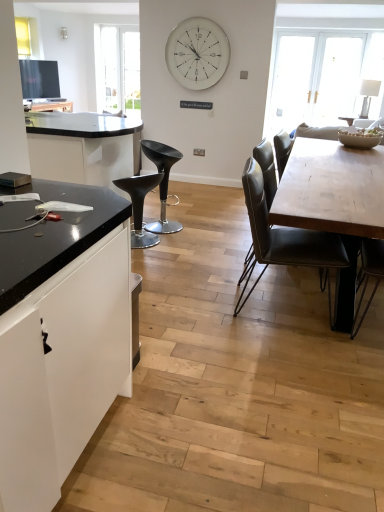
What do you see at coordinates (197, 53) in the screenshot? Image resolution: width=384 pixels, height=512 pixels. I see `white glossy clock at upper center` at bounding box center [197, 53].

Find the location of a particular element. leather-like black chair at center, marked as the first chair in a right-to-left arrangement is located at coordinates (285, 240).

Identify the location of black plastic stool at center, which appears as the third chair when viewed from the front. The image size is (384, 512). (162, 182).

The image size is (384, 512). What do you see at coordinates (334, 204) in the screenshot?
I see `wooden table at center` at bounding box center [334, 204].

Where is `matte black stool at center, marked as the 1th chair in a left-to-right arrangement`? This screenshot has height=512, width=384. matte black stool at center, marked as the 1th chair in a left-to-right arrangement is located at coordinates (140, 206).

Find the location of a particular element. This screenshot has height=512, width=384. white glossy clock at upper center is located at coordinates (197, 53).

Is black plastic stool at center, marked as the 1th chair in a back-to-front arrangement, taller or shorter than white glossy clock at upper center?

Considering their sizes, black plastic stool at center, marked as the 1th chair in a back-to-front arrangement, has less height than white glossy clock at upper center.

Identify the location of the 1st chair counting from the left side of the white glossy clock at upper center. (162, 182).

From the image's perspective, is black plastic stool at center, the second chair viewed from the left, above or below white glossy clock at upper center?

Clearly, from the image's perspective, black plastic stool at center, the second chair viewed from the left, is below white glossy clock at upper center.

Which object is thinner, black plastic stool at center, the second chair viewed from the left, or white glossy clock at upper center?

white glossy clock at upper center is thinner.

Locate an element on the screen. This screenshot has width=384, height=512. clock above the matte black stool at center, the 2th chair positioned from the front (from the image's perspective) is located at coordinates (197, 53).

Would you consider matte black stool at center, placed as the third chair when sorted from right to left, to be distant from white glossy clock at upper center?

matte black stool at center, placed as the third chair when sorted from right to left, is positioned a significant distance from white glossy clock at upper center.

Consider the image. Which is behind, matte black stool at center, which appears as the 2th chair when viewed from the back, or white glossy clock at upper center?

white glossy clock at upper center is further away from the camera.

Is point (131, 194) positioned before point (226, 38)?

Yes, point (131, 194) is in front of point (226, 38).

Considering the relative sizes of matte black stool at center, which appears as the 2th chair when viewed from the back, and wooden table at center in the image provided, is matte black stool at center, which appears as the 2th chair when viewed from the back, bigger than wooden table at center?

No.

Considering the relative positions of matte black stool at center, marked as the 1th chair in a left-to-right arrangement, and wooden table at center in the image provided, is matte black stool at center, marked as the 1th chair in a left-to-right arrangement, to the left of wooden table at center from the viewer's perspective?

Correct, you'll find matte black stool at center, marked as the 1th chair in a left-to-right arrangement, to the left of wooden table at center.

From a real-world perspective, is matte black stool at center, the 2th chair positioned from the front, above or below wooden table at center?

From a real-world perspective, matte black stool at center, the 2th chair positioned from the front, is physically below wooden table at center.

Is matte black stool at center, marked as the 1th chair in a left-to-right arrangement, positioned far away from wooden table at center?

Yes, matte black stool at center, marked as the 1th chair in a left-to-right arrangement, and wooden table at center are located far from each other.

Which is more to the left, black plastic stool at center, the second chair viewed from the left, or wooden table at center?

black plastic stool at center, the second chair viewed from the left.

Choose the correct answer: Is black plastic stool at center, the second chair from the right, inside wooden table at center or outside it?

black plastic stool at center, the second chair from the right, is not inside wooden table at center, it's outside.

In the scene shown: From a real-world perspective, which object rests below the other?

In real-world perspective, black plastic stool at center, marked as the 1th chair in a back-to-front arrangement, is lower.

Is black plastic stool at center, the second chair from the right, directly adjacent to wooden table at center?

black plastic stool at center, the second chair from the right, is not next to wooden table at center, and they're not touching.

Looking at their sizes, would you say wooden table at center is wider or thinner than leather-like black chair at center, marked as the first chair in a right-to-left arrangement?

In the image, wooden table at center appears to be wider than leather-like black chair at center, marked as the first chair in a right-to-left arrangement.

How many degrees apart are the facing directions of wooden table at center and leather-like black chair at center, which appears as the first chair when viewed from the front?

176 degrees separate the facing orientations of wooden table at center and leather-like black chair at center, which appears as the first chair when viewed from the front.

Between point (332, 153) and point (249, 160), which one is positioned behind?

Positioned behind is point (332, 153).

From a real-world perspective, relative to leather-like black chair at center, which appears as the first chair when viewed from the front, is wooden table at center vertically above or below?

In terms of real-world spatial position, wooden table at center is below leather-like black chair at center, which appears as the first chair when viewed from the front.

Can you confirm if wooden table at center is bigger than matte black stool at center, marked as the 1th chair in a left-to-right arrangement?

Yes, wooden table at center is bigger than matte black stool at center, marked as the 1th chair in a left-to-right arrangement.

Are wooden table at center and matte black stool at center, placed as the third chair when sorted from right to left, making contact?

No, wooden table at center is not beside matte black stool at center, placed as the third chair when sorted from right to left.

From a real-world perspective, is wooden table at center on matte black stool at center, which appears as the 2th chair when viewed from the back?

Yes, from a real-world perspective, wooden table at center is on top of matte black stool at center, which appears as the 2th chair when viewed from the back.

Based on the photo, from the image's perspective, would you say wooden table at center is shown under matte black stool at center, marked as the 1th chair in a left-to-right arrangement?

Correct, wooden table at center appears lower than matte black stool at center, marked as the 1th chair in a left-to-right arrangement, in the image.

From the image's perspective, which one is positioned higher, leather-like black chair at center, which appears as the first chair when viewed from the front, or matte black stool at center, marked as the 1th chair in a left-to-right arrangement?

From the image's view, matte black stool at center, marked as the 1th chair in a left-to-right arrangement, is above.

Considering the relative sizes of leather-like black chair at center, marked as the third chair in a left-to-right arrangement, and matte black stool at center, placed as the third chair when sorted from right to left, in the image provided, is leather-like black chair at center, marked as the third chair in a left-to-right arrangement, taller than matte black stool at center, placed as the third chair when sorted from right to left,?

Indeed, leather-like black chair at center, marked as the third chair in a left-to-right arrangement, has a greater height compared to matte black stool at center, placed as the third chair when sorted from right to left.

Visually, is leather-like black chair at center, marked as the first chair in a right-to-left arrangement, positioned to the left or to the right of matte black stool at center, the 2th chair positioned from the front?

Clearly, leather-like black chair at center, marked as the first chair in a right-to-left arrangement, is on the right of matte black stool at center, the 2th chair positioned from the front, in the image.

Is leather-like black chair at center, marked as the third chair in a left-to-right arrangement, situated inside matte black stool at center, marked as the 1th chair in a left-to-right arrangement, or outside?

leather-like black chair at center, marked as the third chair in a left-to-right arrangement, is not inside matte black stool at center, marked as the 1th chair in a left-to-right arrangement, it's outside.

Starting from the white glossy clock at upper center, which chair is the 1st one in front? Please provide its 2D coordinates.

[(162, 182)]

I want to click on the 2nd chair to the left of the white glossy clock at upper center, counting from the anchor's position, so click(x=140, y=206).

From the image, which object appears to be farther from black plastic stool at center, the second chair viewed from the left, leather-like black chair at center, the 3th chair when ordered from back to front, or wooden table at center?

wooden table at center is further to black plastic stool at center, the second chair viewed from the left.

Considering their positions, is wooden table at center positioned closer to matte black stool at center, marked as the 1th chair in a left-to-right arrangement, than leather-like black chair at center, marked as the third chair in a left-to-right arrangement?

Based on the image, leather-like black chair at center, marked as the third chair in a left-to-right arrangement, appears to be nearer to matte black stool at center, marked as the 1th chair in a left-to-right arrangement.

From the image, which object appears to be nearer to white glossy clock at upper center, wooden table at center or black matte cabinet at left?

Based on the image, wooden table at center appears to be nearer to white glossy clock at upper center.

Looking at the image, which one is located further to black matte cabinet at left, wooden table at center or leather-like black chair at center, which appears as the first chair when viewed from the front?

leather-like black chair at center, which appears as the first chair when viewed from the front.

From the picture: From the image, which object appears to be farther from white glossy clock at upper center, black plastic stool at center, marked as the 1th chair in a back-to-front arrangement, or wooden table at center?

wooden table at center is further to white glossy clock at upper center.

Estimate the real-world distances between objects in this image. Which object is closer to wooden table at center, leather-like black chair at center, the 3th chair when ordered from back to front, or black matte cabinet at left?

leather-like black chair at center, the 3th chair when ordered from back to front, is closer to wooden table at center.

Looking at the image, which one is located further to leather-like black chair at center, marked as the third chair in a left-to-right arrangement, white glossy clock at upper center or black plastic stool at center, which appears as the third chair when viewed from the front?

Based on the image, white glossy clock at upper center appears to be further to leather-like black chair at center, marked as the third chair in a left-to-right arrangement.

Based on their spatial positions, is wooden table at center or leather-like black chair at center, which appears as the first chair when viewed from the front, further from black plastic stool at center, marked as the 1th chair in a back-to-front arrangement?

Among the two, wooden table at center is located further to black plastic stool at center, marked as the 1th chair in a back-to-front arrangement.

The width and height of the screenshot is (384, 512). In order to click on round table between black matte cabinet at left and matte black stool at center, the 2th chair positioned from the front, in the front-back direction in this screenshot , I will do `click(334, 204)`.

What are the coordinates of `chair between black matte cabinet at left and matte black stool at center, placed as the third chair when sorted from right to left, along the z-axis` in the screenshot? It's located at (285, 240).

In order to click on chair between leather-like black chair at center, marked as the third chair in a left-to-right arrangement, and black plastic stool at center, marked as the 1th chair in a back-to-front arrangement, in the front-back direction in this screenshot , I will do `click(140, 206)`.

Where is `chair between white glossy clock at upper center and matte black stool at center, the 2th chair positioned from the front, vertically`? Image resolution: width=384 pixels, height=512 pixels. chair between white glossy clock at upper center and matte black stool at center, the 2th chair positioned from the front, vertically is located at coordinates (162, 182).